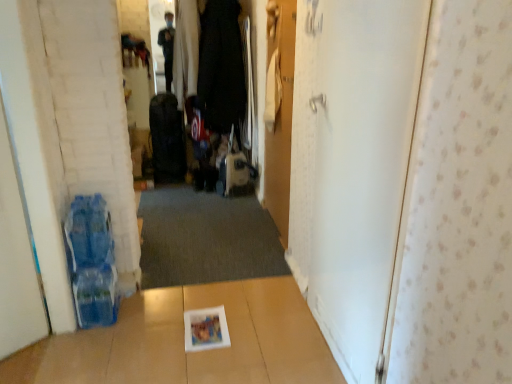
You are a GUI agent. You are given a task and a screenshot of the screen. Output one action in this format:
    pyautogui.click(x=<x>, y=<y>)
    Task: Click on the free point above white glossy magazine at center (from a real-world perspective)
    
    Given the screenshot: What is the action you would take?
    pyautogui.click(x=206, y=325)